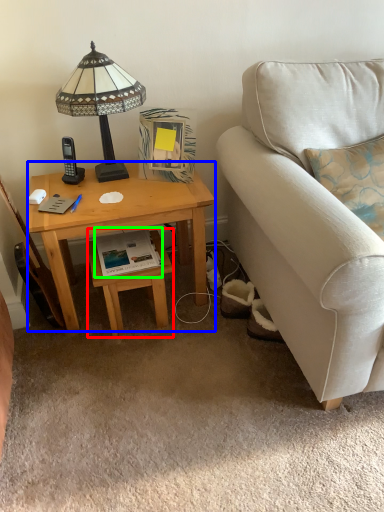
Question: Which object is the farthest from stool (highlighted by a red box)? Choose among these: desk (highlighted by a blue box) or book (highlighted by a green box).

Choices:
 (A) desk
 (B) book

Answer: (A)